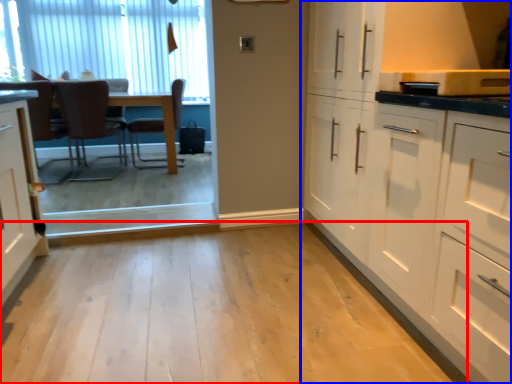
Question: Which of the following is the farthest to the observer, plain (highlighted by a red box) or cabinetry (highlighted by a blue box)?

Choices:
 (A) plain
 (B) cabinetry

Answer: (B)